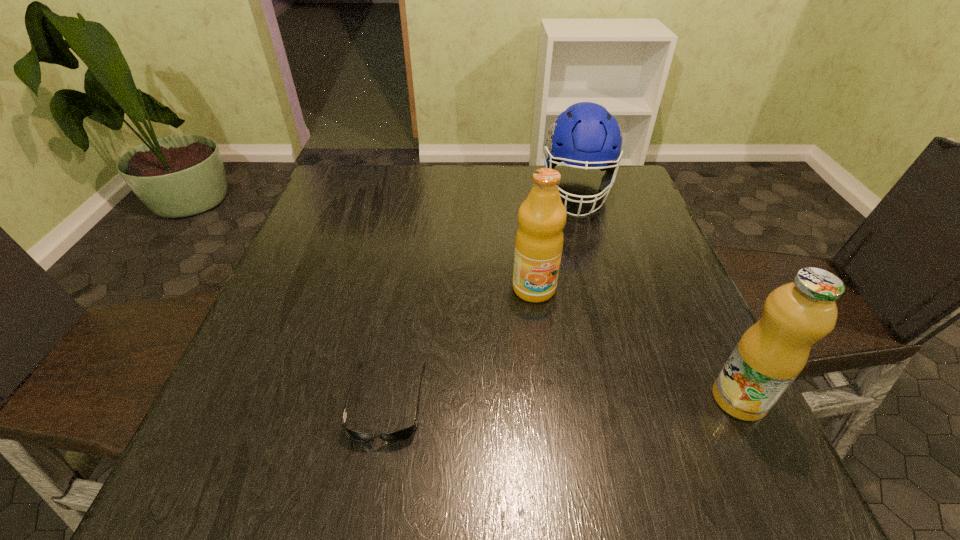
What are the coordinates of `sunglasses` in the screenshot? It's located at (403, 434).

The height and width of the screenshot is (540, 960). Find the location of `the shortest object`. the shortest object is located at coordinates (403, 434).

At what (x,y) coordinates should I click in order to perform the action: click on the right fruit juice. Please return your answer as a coordinate pair (x, y). Looking at the image, I should click on (769, 356).

Where is `the nearer fruit juice`? Image resolution: width=960 pixels, height=540 pixels. the nearer fruit juice is located at coordinates (769, 356).

Where is `the third object from right to left`? The width and height of the screenshot is (960, 540). the third object from right to left is located at coordinates (539, 240).

This screenshot has width=960, height=540. What are the coordinates of `the third nearest object` in the screenshot? It's located at (539, 240).

The width and height of the screenshot is (960, 540). What are the coordinates of `the farthest object` in the screenshot? It's located at (585, 134).

Where is `the second object from right to left`? This screenshot has width=960, height=540. the second object from right to left is located at coordinates (585, 134).

I want to click on vacant region located 0.120m on the front label of the second object from left to right, so click(x=552, y=350).

The height and width of the screenshot is (540, 960). What are the coordinates of `free point located 0.150m on the front label of the second object from left to right` in the screenshot? It's located at (556, 363).